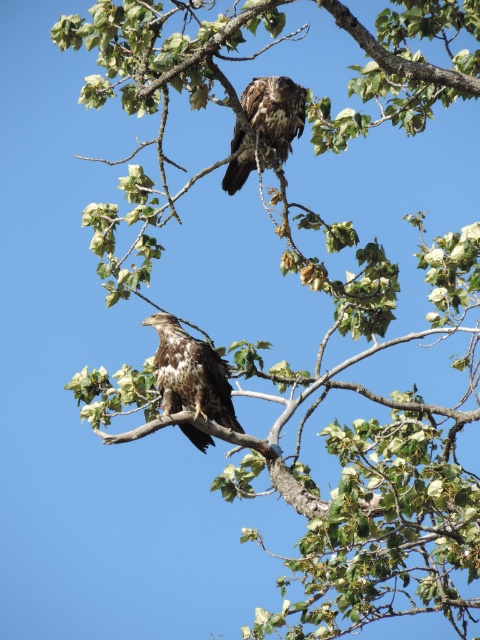
You are standing in front of the tree and want to know which point is closer to you. The points are labeled as point A at coordinates point A is point (205, 444) and point B is point (242, 148). Which point is closer to you?

Point B is closer to you because point A is further to the camera than point B.

You are a birdwatcher observing the two birds in the scene. Which bird, the brown speckled feathers at center or the dark brown feathers at upper center, is located higher up in the tree?

The dark brown feathers at upper center is located higher up in the tree than the brown speckled feathers at center.

You are an ornithologist observing two birds in a tree. You notice the brown speckled feathers at center and the dark brown feathers at upper center. Which bird is positioned to the left side of the other?

The brown speckled feathers at center is to the left of dark brown feathers at upper center, so the brown speckled feathers at center is positioned to the left side of the dark brown feathers at upper center.